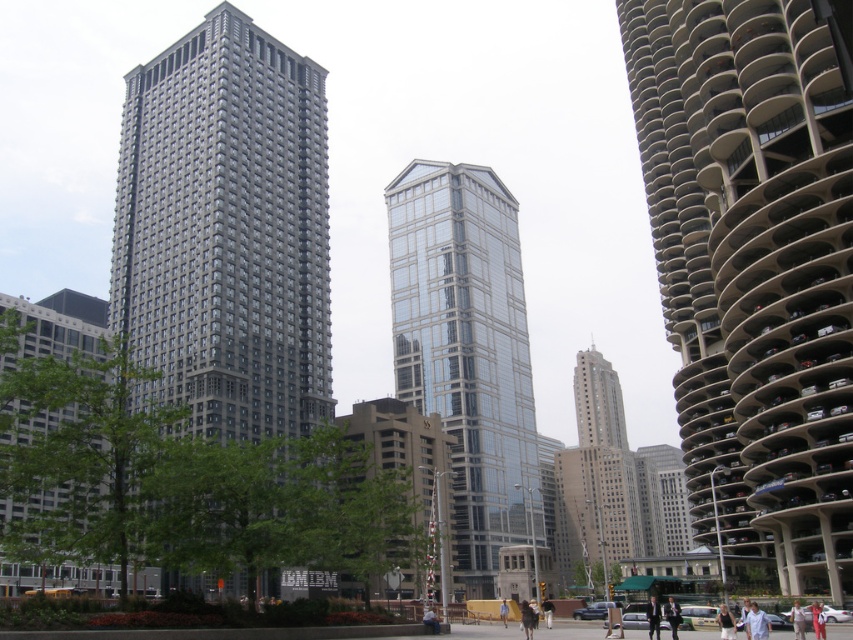
This screenshot has width=853, height=640. In order to click on light brown fabric pants at center in this screenshot , I will do `click(798, 620)`.

What do you see at coordinates (798, 620) in the screenshot? I see `light brown fabric pants at center` at bounding box center [798, 620].

Which is behind, point (795, 614) or point (503, 612)?

Point (503, 612)

At what (x,y) coordinates should I click in order to perform the action: click on light brown fabric pants at center. Please return your answer as a coordinate pair (x, y). The height and width of the screenshot is (640, 853). Looking at the image, I should click on (798, 620).

Is point (523, 614) less distant than point (503, 611)?

Yes, it is in front of point (503, 611).

Is dark brown leather jacket at center wider than light blue jeans at center?

Yes.

Locate an element on the screen. The image size is (853, 640). dark brown leather jacket at center is located at coordinates (527, 618).

Can you confirm if beige concrete parking garage at right is taller than dark suit at center?

Yes.

Which is below, beige concrete parking garage at right or dark suit at center?

dark suit at center is below.

Between point (778, 88) and point (654, 621), which one is positioned in front?

Point (654, 621) is in front.

Locate an element on the screen. The image size is (853, 640). beige concrete parking garage at right is located at coordinates (753, 269).